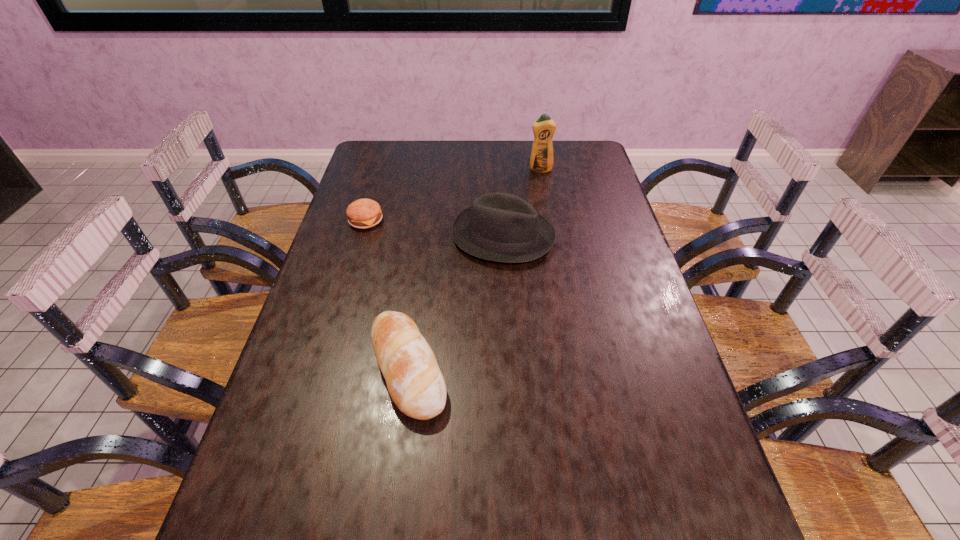
Identify the location of empty space between the shortest object and the second shortest object. The height and width of the screenshot is (540, 960). (387, 294).

The width and height of the screenshot is (960, 540). What are the coordinates of `vacant area between the third tallest object and the fedora` in the screenshot? It's located at (456, 302).

This screenshot has width=960, height=540. I want to click on vacant area that lies between the leftmost object and the farthest object, so click(x=453, y=195).

Identify the location of free area in between the fedora and the hamburger. This screenshot has height=540, width=960. (435, 228).

At what (x,y) coordinates should I click in order to perform the action: click on empty space that is in between the shortest object and the detergent. Please return your answer as a coordinate pair (x, y). Looking at the image, I should click on (453, 195).

Select which object appears as the second closest to the tallest object. Please provide its 2D coordinates. Your answer should be formatted as a tuple, i.e. [(x, y)], where the tuple contains the x and y coordinates of a point satisfying the conditions above.

[(364, 213)]

Locate an element on the screen. The height and width of the screenshot is (540, 960). object that stands as the third closest to the bread is located at coordinates (541, 160).

Locate an element on the screen. vacant space that satisfies the following two spatial constraints: 1. on the back side of the bread; 2. on the left side of the fedora is located at coordinates (425, 236).

Where is `vacant position in the image that satisfies the following two spatial constraints: 1. on the front side of the bread; 2. on the right side of the hamburger`? The height and width of the screenshot is (540, 960). vacant position in the image that satisfies the following two spatial constraints: 1. on the front side of the bread; 2. on the right side of the hamburger is located at coordinates (322, 368).

Identify the location of vacant space that satisfies the following two spatial constraints: 1. on the back side of the bread; 2. on the right side of the third shortest object. This screenshot has width=960, height=540. (425, 236).